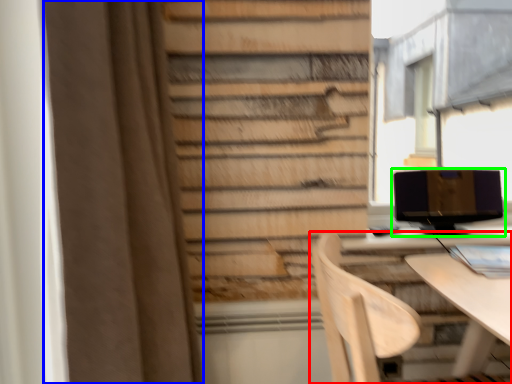
Question: Which object is positioned closest to chair (highlighted by a red box)? Select from curtain (highlighted by a blue box) and computer monitor (highlighted by a green box).

Choices:
 (A) curtain
 (B) computer monitor

Answer: (A)